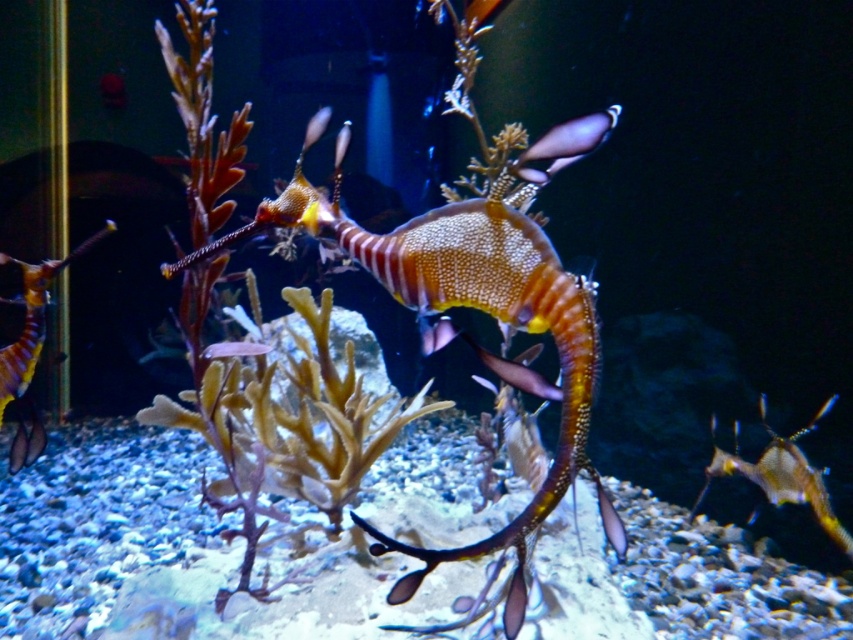
Does shiny orange seahorse at left have a greater width compared to shiny purple fish at upper center?

Indeed, shiny orange seahorse at left has a greater width compared to shiny purple fish at upper center.

Can you confirm if shiny orange seahorse at left is positioned to the left of shiny purple fish at upper center?

Yes, shiny orange seahorse at left is to the left of shiny purple fish at upper center.

Image resolution: width=853 pixels, height=640 pixels. Find the location of `shiny orange seahorse at left`. shiny orange seahorse at left is located at coordinates (32, 348).

Is the position of shiny metallic seahorse at center more distant than that of shiny purple fish at upper center?

Yes, it is.

Where is `shiny metallic seahorse at center`? Image resolution: width=853 pixels, height=640 pixels. shiny metallic seahorse at center is located at coordinates 780,474.

Locate an element on the screen. The image size is (853, 640). shiny metallic seahorse at center is located at coordinates (780, 474).

Where is `shiny metallic seahorse at center`? shiny metallic seahorse at center is located at coordinates (780, 474).

Is shiny orange seahorse at left above shiny metallic seahorse at center?

Yes, shiny orange seahorse at left is above shiny metallic seahorse at center.

Does shiny orange seahorse at left have a greater width compared to shiny metallic seahorse at center?

No, shiny orange seahorse at left is not wider than shiny metallic seahorse at center.

Is point (22, 396) farther from camera compared to point (780, 445)?

Yes.

Where is `shiny orange seahorse at left`? The height and width of the screenshot is (640, 853). shiny orange seahorse at left is located at coordinates (32, 348).